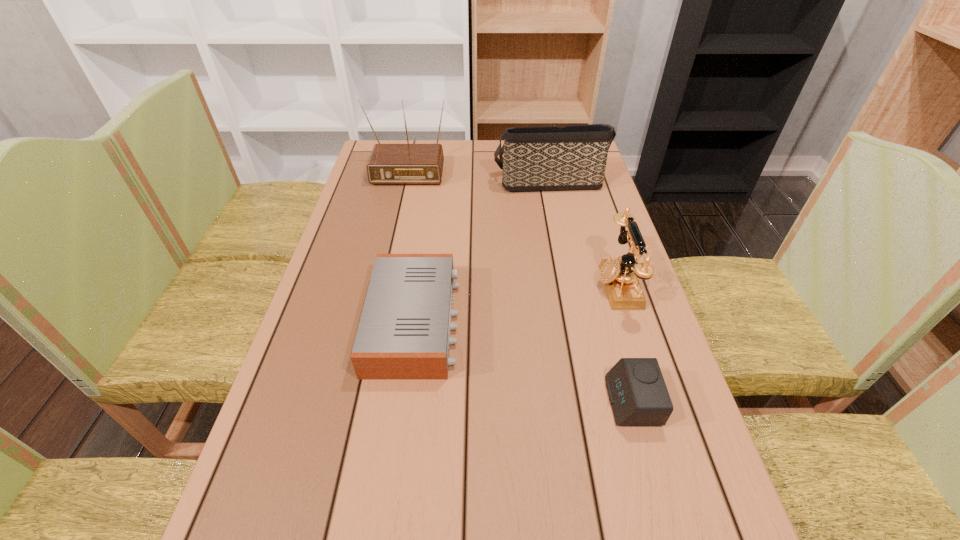
Find the location of a particular element. This screenshot has height=540, width=960. object situated at the far right corner is located at coordinates (541, 158).

Identify the location of vacant space at the far edge of the desktop. The width and height of the screenshot is (960, 540). (461, 143).

In the image, there is a desktop. Where is `free region at the left edge`? The image size is (960, 540). free region at the left edge is located at coordinates (348, 348).

In the image, there is a desktop. At what (x,y) coordinates should I click in order to perform the action: click on vacant space at the right edge. Please return your answer as a coordinate pair (x, y). Looking at the image, I should click on (606, 373).

Identify the location of unoccupied position between the taller radio receiver and the telephone. The width and height of the screenshot is (960, 540). (513, 225).

Locate an element on the screen. The width and height of the screenshot is (960, 540). free space between the shorter radio receiver and the handbag is located at coordinates (481, 252).

Find the location of `free space between the handbag and the alarm clock`. free space between the handbag and the alarm clock is located at coordinates (590, 291).

At what (x,y) coordinates should I click in order to perform the action: click on free space that is in between the nearer radio receiver and the telephone. Please return your answer as a coordinate pair (x, y). This screenshot has width=960, height=540. Looking at the image, I should click on click(x=516, y=303).

Find the location of a particular element. free space between the farther radio receiver and the alarm clock is located at coordinates (520, 283).

Locate an element on the screen. Image resolution: width=960 pixels, height=540 pixels. vacant area that lies between the handbag and the alarm clock is located at coordinates (590, 291).